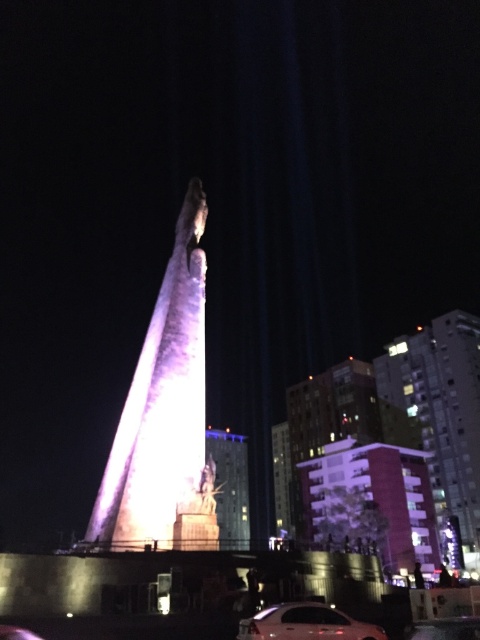
How distant is shiny silver sedan at center from shiny metallic statue at center?

shiny silver sedan at center and shiny metallic statue at center are 45.30 meters apart from each other.

Between point (324, 632) and point (249, 540), which one is positioned in front?

Positioned in front is point (324, 632).

Between point (325, 637) and point (237, 449), which one is positioned behind?

The point (237, 449) is behind.

Find the location of a particular element. This screenshot has width=480, height=640. shiny silver sedan at center is located at coordinates (305, 624).

Is illuminated stone tower at center positioned before pink concrete building at right?

Yes.

Does point (152, 337) come closer to viewer compared to point (463, 380)?

Yes, point (152, 337) is closer to viewer.

You are a GUI agent. You are given a task and a screenshot of the screen. Output one action in this format:
    pyautogui.click(x=<x>, y=<y>)
    Task: Click on the illuminated stone tower at center
    The height and width of the screenshot is (640, 480).
    Given the screenshot: What is the action you would take?
    pyautogui.click(x=160, y=404)

Who is more distant from viewer, (x=417, y=390) or (x=229, y=499)?

Point (x=229, y=499)

This screenshot has height=640, width=480. I want to click on pink concrete building at right, so click(x=442, y=416).

The width and height of the screenshot is (480, 640). What do you see at coordinates (442, 416) in the screenshot?
I see `pink concrete building at right` at bounding box center [442, 416].

This screenshot has height=640, width=480. Identify the location of pink concrete building at right. (442, 416).